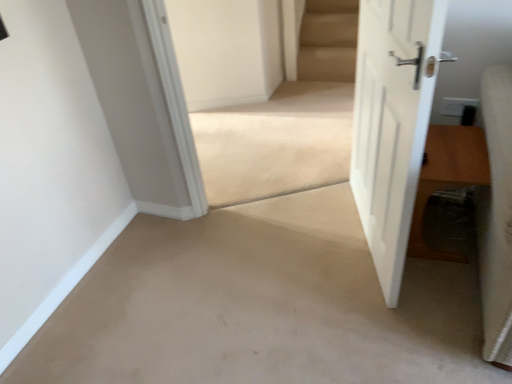
Question: Is white matte door at right thinner than beige carpet at center?

Choices:
 (A) yes
 (B) no

Answer: (A)

Question: Are white matte door at right and beige carpet at center making contact?

Choices:
 (A) yes
 (B) no

Answer: (B)

Question: Could you tell me if white matte door at right is facing beige carpet at center?

Choices:
 (A) yes
 (B) no

Answer: (A)

Question: From the image's perspective, does white matte door at right appear lower than beige carpet at center?

Choices:
 (A) no
 (B) yes

Answer: (B)

Question: Considering the relative sizes of white matte door at right and beige carpet at center in the image provided, is white matte door at right shorter than beige carpet at center?

Choices:
 (A) no
 (B) yes

Answer: (A)

Question: Is beige carpet at center bigger or smaller than white matte door at right?

Choices:
 (A) big
 (B) small

Answer: (B)

Question: Is point (252, 137) closer or farther from the camera than point (373, 170)?

Choices:
 (A) closer
 (B) farther

Answer: (B)

Question: Would you say beige carpet at center is inside or outside white matte door at right?

Choices:
 (A) inside
 (B) outside

Answer: (B)

Question: Is beige carpet at center wider or thinner than white matte door at right?

Choices:
 (A) thin
 (B) wide

Answer: (B)

Question: Is white matte door at right in front of or behind beige carpet at center in the image?

Choices:
 (A) behind
 (B) front

Answer: (B)

Question: From a real-world perspective, is white matte door at right physically located above or below beige carpet at center?

Choices:
 (A) below
 (B) above

Answer: (B)

Question: Based on their sizes in the image, would you say white matte door at right is bigger or smaller than beige carpet at center?

Choices:
 (A) big
 (B) small

Answer: (A)

Question: Considering the positions of white matte door at right and beige carpet at center in the image, is white matte door at right wider or thinner than beige carpet at center?

Choices:
 (A) wide
 (B) thin

Answer: (B)

Question: From a real-world perspective, is white matte door at right positioned above or below brown wooden table at right?

Choices:
 (A) above
 (B) below

Answer: (A)

Question: Is white matte door at right wider or thinner than brown wooden table at right?

Choices:
 (A) wide
 (B) thin

Answer: (B)